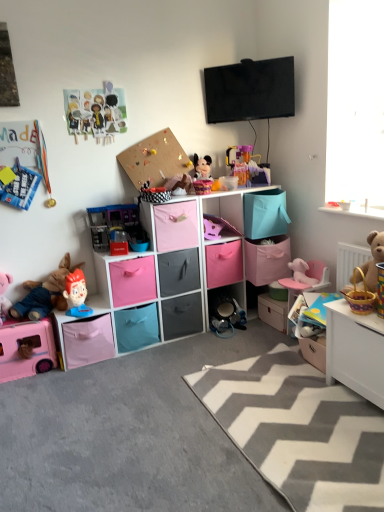
What do you see at coordinates (224, 264) in the screenshot? The height and width of the screenshot is (512, 384). I see `pink fabric drawer at center, the 2th drawer in the right-to-left sequence` at bounding box center [224, 264].

Measure the distance between point (111, 206) and camera.

Point (111, 206) and camera are 8.53 feet apart.

This screenshot has width=384, height=512. What are the coordinates of `pink fabric cardboard box at lower left` in the screenshot? It's located at (88, 341).

In order to face matte black drawer at center, the fourth drawer positioned from the right, should I rotate leftwards or rightwards?

To face it directly, rotate left by 2.556 degrees.

You are a GUI agent. You are given a task and a screenshot of the screen. Output one action in this format:
    pyautogui.click(x=<x>, y=<y>)
    Task: Click on the pink fabric cabinet at center, the 3th cabinet ordered from the bottom
    
    Given the screenshot: What is the action you would take?
    pyautogui.click(x=225, y=213)

The height and width of the screenshot is (512, 384). I want to click on pink fabric stuffed animal at center-right, which is the 2th toy from right to left, so click(x=302, y=272).

What is the approximate width of plastic toy at left, the third toy from the left?

The width of plastic toy at left, the third toy from the left, is 6.30 inches.

Where is `pink fabric drawer at center, the 2th drawer in the right-to-left sequence`? pink fabric drawer at center, the 2th drawer in the right-to-left sequence is located at coordinates (224, 264).

Considering the positions of objects pink fabric plush at center, the 4th toy in the right-to-left sequence, and transparent glass window at upper right in the image provided, who is more to the left, pink fabric plush at center, the 4th toy in the right-to-left sequence, or transparent glass window at upper right?

Positioned to the left is pink fabric plush at center, the 4th toy in the right-to-left sequence.

Which object is further away from the camera, pink fabric plush at center, the 4th toy in the right-to-left sequence, or transparent glass window at upper right?

Positioned behind is pink fabric plush at center, the 4th toy in the right-to-left sequence.

Can you confirm if pink fabric plush at center, positioned as the 7th toy in left-to-right order, is bigger than transparent glass window at upper right?

No, pink fabric plush at center, positioned as the 7th toy in left-to-right order, is not bigger than transparent glass window at upper right.

Is transparent glass window at upper right not close to pink fabric plush at center, positioned as the 7th toy in left-to-right order?

transparent glass window at upper right is far away from pink fabric plush at center, positioned as the 7th toy in left-to-right order.

Does transparent glass window at upper right appear on the left side of pink fabric plush at center, positioned as the 7th toy in left-to-right order?

No.

Is transparent glass window at upper right taller than pink fabric plush at center, positioned as the 7th toy in left-to-right order?

Correct, transparent glass window at upper right is much taller as pink fabric plush at center, positioned as the 7th toy in left-to-right order.

Is point (340, 114) closer or farther from the camera than point (221, 229)?

Clearly, point (340, 114) is closer to the camera than point (221, 229).

Is plush fabric toy at left, which is the 9th toy in right-to-left order, positioned with its back to pink fabric storage cube at center, which appears as the 2th cabinet when ordered from the bottom?

That's not correct — plush fabric toy at left, which is the 9th toy in right-to-left order, is not looking away from pink fabric storage cube at center, which appears as the 2th cabinet when ordered from the bottom.

Is plush fabric toy at left, acting as the 2th toy starting from the left, in front of or behind pink fabric storage cube at center, positioned as the second cabinet in top-to-bottom order, in the image?

plush fabric toy at left, acting as the 2th toy starting from the left, is positioned closer to the viewer than pink fabric storage cube at center, positioned as the second cabinet in top-to-bottom order.

Find the location of `the 4th toy counting from the left of the pink fabric storage cube at center, positioned as the second cabinet in top-to-bottom order`. the 4th toy counting from the left of the pink fabric storage cube at center, positioned as the second cabinet in top-to-bottom order is located at coordinates tap(45, 293).

Looking at their sizes, would you say plush fabric toy at left, which is the 9th toy in right-to-left order, is wider or thinner than pink fabric storage cube at center, positioned as the second cabinet in top-to-bottom order?

Clearly, plush fabric toy at left, which is the 9th toy in right-to-left order, has less width compared to pink fabric storage cube at center, positioned as the second cabinet in top-to-bottom order.

Is wooden drawer at center, which is the first drawer from right to left, aimed at pink fabric drawer at center, the sixth drawer in the right-to-left sequence?

No, wooden drawer at center, which is the first drawer from right to left, is not aimed at pink fabric drawer at center, the sixth drawer in the right-to-left sequence.

Which of these two, wooden drawer at center, which is the sixth drawer in left-to-right order, or pink fabric drawer at center, which is the first drawer from left to right, stands taller?

With more height is pink fabric drawer at center, which is the first drawer from left to right.

From the image's perspective, is wooden drawer at center, which is the sixth drawer in left-to-right order, above or below pink fabric drawer at center, the sixth drawer in the right-to-left sequence?

wooden drawer at center, which is the sixth drawer in left-to-right order, is situated lower than pink fabric drawer at center, the sixth drawer in the right-to-left sequence, in the image.

Is wooden drawer at center, which is the first drawer from right to left, spatially inside pink fabric drawer at center, which is the first drawer from left to right, or outside of it?

wooden drawer at center, which is the first drawer from right to left, is not enclosed by pink fabric drawer at center, which is the first drawer from left to right.

Can you confirm if plastic play kitchen at center, which is the 5th toy from left to right, is thinner than white glossy table at lower right?

Indeed, plastic play kitchen at center, which is the 5th toy from left to right, has a lesser width compared to white glossy table at lower right.

Is plastic play kitchen at center, which is the 5th toy from left to right, inside or outside of white glossy table at lower right?

plastic play kitchen at center, which is the 5th toy from left to right, is outside white glossy table at lower right.

Between plastic play kitchen at center, which appears as the 6th toy when viewed from the right, and white glossy table at lower right, which one is positioned behind?

Positioned behind is plastic play kitchen at center, which appears as the 6th toy when viewed from the right.

From the image's perspective, is plastic play kitchen at center, which appears as the 6th toy when viewed from the right, positioned above or below white glossy table at lower right?

plastic play kitchen at center, which appears as the 6th toy when viewed from the right, is situated higher than white glossy table at lower right in the image.

Is pink fabric drawer at center, the second drawer positioned from the left, looking in the opposite direction of wooden drawer at center, which is the first drawer from right to left?

No, pink fabric drawer at center, the second drawer positioned from the left, is not facing away from wooden drawer at center, which is the first drawer from right to left.

From the image's perspective, is pink fabric drawer at center, the second drawer positioned from the left, above or below wooden drawer at center, which is the sixth drawer in left-to-right order?

From the image's perspective, pink fabric drawer at center, the second drawer positioned from the left, appears below wooden drawer at center, which is the sixth drawer in left-to-right order.

Considering the relative sizes of pink fabric drawer at center, the second drawer positioned from the left, and wooden drawer at center, which is the first drawer from right to left, in the image provided, is pink fabric drawer at center, the second drawer positioned from the left, shorter than wooden drawer at center, which is the first drawer from right to left,?

In fact, pink fabric drawer at center, the second drawer positioned from the left, may be taller than wooden drawer at center, which is the first drawer from right to left.

Is pink fabric drawer at center, the fifth drawer viewed from the right, bigger or smaller than wooden drawer at center, which is the sixth drawer in left-to-right order?

In the image, pink fabric drawer at center, the fifth drawer viewed from the right, appears to be larger than wooden drawer at center, which is the sixth drawer in left-to-right order.

Is matte pink plush at center, the sixth toy positioned from the left, situated inside pink fabric cardboard box at lower left or outside?

matte pink plush at center, the sixth toy positioned from the left, is not enclosed by pink fabric cardboard box at lower left.

Between matte pink plush at center, the fifth toy when ordered from right to left, and pink fabric cardboard box at lower left, which one is positioned behind?

matte pink plush at center, the fifth toy when ordered from right to left, is behind.

From the picture: Is matte pink plush at center, the sixth toy positioned from the left, far from pink fabric cardboard box at lower left?

No, matte pink plush at center, the sixth toy positioned from the left, is in close proximity to pink fabric cardboard box at lower left.

Does matte pink plush at center, the fifth toy when ordered from right to left, turn towards pink fabric cardboard box at lower left?

No, matte pink plush at center, the fifth toy when ordered from right to left, is not facing towards pink fabric cardboard box at lower left.

Locate an element on the screen. window screen above the pink fabric plush at center, positioned as the 7th toy in left-to-right order (from the image's perspective) is located at coordinates (355, 102).

Find the location of `the 4th toy to the left of the transparent glass window at upper right, counting from the anchor's position`. the 4th toy to the left of the transparent glass window at upper right, counting from the anchor's position is located at coordinates pos(211,229).

Estimate the real-world distances between objects in this image. Which object is further from pink fabric plush at center, the 4th toy in the right-to-left sequence, plastic play kitchen at center, which is the 5th toy from left to right, or matte paper dolls at upper left, the 7th toy from the right?

The object further to pink fabric plush at center, the 4th toy in the right-to-left sequence, is matte paper dolls at upper left, the 7th toy from the right.

Considering their positions, is pink plastic toy car at lower left, which appears as the 10th toy when viewed from the right, positioned closer to pink fabric drawer at center, the sixth drawer in the right-to-left sequence, than pink fabric storage cube at center, which appears as the 2th cabinet when ordered from the bottom?

pink fabric storage cube at center, which appears as the 2th cabinet when ordered from the bottom, is closer to pink fabric drawer at center, the sixth drawer in the right-to-left sequence.

When comparing their distances from wooden drawer at center, which is the first drawer from right to left, does plush fabric toy at left, acting as the 2th toy starting from the left, or transparent glass window at upper right seem further?

Based on the image, plush fabric toy at left, acting as the 2th toy starting from the left, appears to be further to wooden drawer at center, which is the first drawer from right to left.

From the picture: Considering their positions, is pink fabric storage cube at center, which appears as the 2th cabinet when ordered from the bottom, positioned closer to pink fabric stuffed animal at center-right, acting as the ninth toy starting from the left, than translucent plastic playset at center, marked as the 8th toy in a left-to-right arrangement?

Based on the image, translucent plastic playset at center, marked as the 8th toy in a left-to-right arrangement, appears to be nearer to pink fabric stuffed animal at center-right, acting as the ninth toy starting from the left.

When comparing their distances from pink plastic toy car at lower left, which appears as the 10th toy when viewed from the right, does plush fabric toy at left, which is the 9th toy in right-to-left order, or pink fabric drawer at center, which is the first drawer from left to right, seem closer?

The object closer to pink plastic toy car at lower left, which appears as the 10th toy when viewed from the right, is plush fabric toy at left, which is the 9th toy in right-to-left order.

Looking at the image, which one is located further to wooden drawer at center, which is the sixth drawer in left-to-right order, pink fabric drawer at center, the second drawer positioned from the left, or pink fabric drawer at center, which is the first drawer from left to right?

The object further to wooden drawer at center, which is the sixth drawer in left-to-right order, is pink fabric drawer at center, which is the first drawer from left to right.

Which object lies further to the anchor point pink fabric plush at center, the 4th toy in the right-to-left sequence, pink fabric cardboard box at lower left or white glossy table at lower right?

white glossy table at lower right.

From the picture: Which object lies nearer to the anchor point matte pink plush at center, the fifth toy when ordered from right to left, white glossy table at lower right or translucent plastic playset at center, the third toy viewed from the right?

The object closer to matte pink plush at center, the fifth toy when ordered from right to left, is translucent plastic playset at center, the third toy viewed from the right.

Locate an element on the screen. shelf between pink plastic toy car at lower left, placed as the first toy when sorted from left to right, and yellow woven basket at right, which ranks as the first toy in right-to-left order, in the horizontal direction is located at coordinates (154, 274).

Locate an element on the screen. Image resolution: width=384 pixels, height=512 pixels. shelf between pink fabric drawer at center, the sixth drawer in the right-to-left sequence, and pink fabric plush at center, the 4th toy in the right-to-left sequence is located at coordinates (154, 274).

This screenshot has height=512, width=384. Identify the location of cabinet situated between pink fabric drawer at center, the sixth drawer in the right-to-left sequence, and pink fabric drawer at center, the fifth drawer in the left-to-right sequence, from left to right. (176, 226).

The image size is (384, 512). What are the coordinates of `shelf located between plastic toy at left, the third toy from the left, and yellow woven basket at right, arranged as the 10th toy when viewed from the left, in the left-right direction` in the screenshot? It's located at (154, 274).